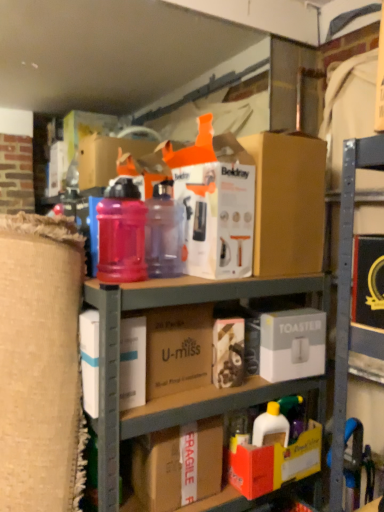
Question: Is cardboard boxes at center completely or partially outside of brown cardboard box at upper center, which appears as the 1th box when viewed from the top?

Choices:
 (A) yes
 (B) no

Answer: (A)

Question: From the image's perspective, would you say cardboard boxes at center is positioned over brown cardboard box at upper center, acting as the fourth box starting from the bottom?

Choices:
 (A) no
 (B) yes

Answer: (A)

Question: Considering the relative sizes of cardboard boxes at center and brown cardboard box at upper center, acting as the fourth box starting from the bottom, in the image provided, is cardboard boxes at center shorter than brown cardboard box at upper center, acting as the fourth box starting from the bottom,?

Choices:
 (A) yes
 (B) no

Answer: (B)

Question: Is cardboard boxes at center in front of brown cardboard box at upper center, which appears as the 1th box when viewed from the top?

Choices:
 (A) no
 (B) yes

Answer: (B)

Question: Can you confirm if cardboard boxes at center is positioned to the right of brown cardboard box at upper center, acting as the fourth box starting from the bottom?

Choices:
 (A) no
 (B) yes

Answer: (A)

Question: Looking at the image, does fragile cardboard box at lower center, which is the 2th cardboard box in top-to-bottom order, seem bigger or smaller compared to brown cardboard at center, which is the first cardboard box in top-to-bottom order?

Choices:
 (A) big
 (B) small

Answer: (B)

Question: Is fragile cardboard box at lower center, which is the 2th cardboard box in top-to-bottom order, taller or shorter than brown cardboard at center, the 2th cardboard box positioned from the bottom?

Choices:
 (A) short
 (B) tall

Answer: (A)

Question: From a real-world perspective, is fragile cardboard box at lower center, acting as the 1th cardboard box starting from the bottom, physically located above or below brown cardboard at center, the 2th cardboard box positioned from the bottom?

Choices:
 (A) above
 (B) below

Answer: (B)

Question: Is fragile cardboard box at lower center, which is the 2th cardboard box in top-to-bottom order, inside the boundaries of brown cardboard at center, which is the first cardboard box in top-to-bottom order, or outside?

Choices:
 (A) outside
 (B) inside

Answer: (A)

Question: In the image, is brown cardboard box at upper center, which appears as the 1th box when viewed from the top, positioned in front of or behind red cardboard box at lower center, the fourth box viewed from the top?

Choices:
 (A) behind
 (B) front

Answer: (A)

Question: Would you say brown cardboard box at upper center, which appears as the 1th box when viewed from the top, is to the left or to the right of red cardboard box at lower center, acting as the first box starting from the bottom, in the picture?

Choices:
 (A) left
 (B) right

Answer: (A)

Question: From a real-world perspective, is brown cardboard box at upper center, which appears as the 1th box when viewed from the top, physically located above or below red cardboard box at lower center, acting as the first box starting from the bottom?

Choices:
 (A) below
 (B) above

Answer: (B)

Question: Is brown cardboard box at upper center, which appears as the 1th box when viewed from the top, inside or outside of red cardboard box at lower center, acting as the first box starting from the bottom?

Choices:
 (A) inside
 (B) outside

Answer: (B)

Question: In terms of size, does white cardboard box at center, which is the 2th box in bottom-to-top order, appear bigger or smaller than brown cardboard at center, the 2th cardboard box positioned from the bottom?

Choices:
 (A) big
 (B) small

Answer: (B)

Question: Considering the positions of white cardboard box at center, marked as the third box in a top-to-bottom arrangement, and brown cardboard at center, which is the first cardboard box in top-to-bottom order, in the image, is white cardboard box at center, marked as the third box in a top-to-bottom arrangement, wider or thinner than brown cardboard at center, which is the first cardboard box in top-to-bottom order,?

Choices:
 (A) wide
 (B) thin

Answer: (B)